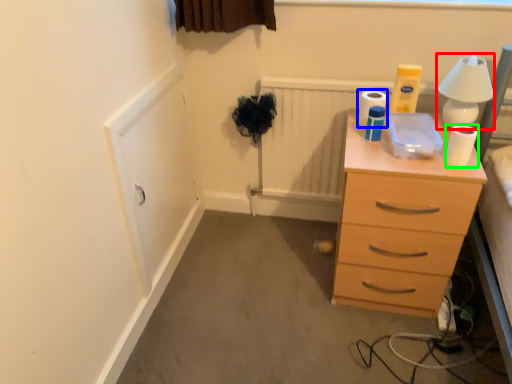
Question: Estimate the real-world distances between objects in this image. Which object is farther from table lamp (highlighted by a red box), toilet paper (highlighted by a blue box) or toilet paper (highlighted by a green box)?

Choices:
 (A) toilet paper
 (B) toilet paper

Answer: (A)